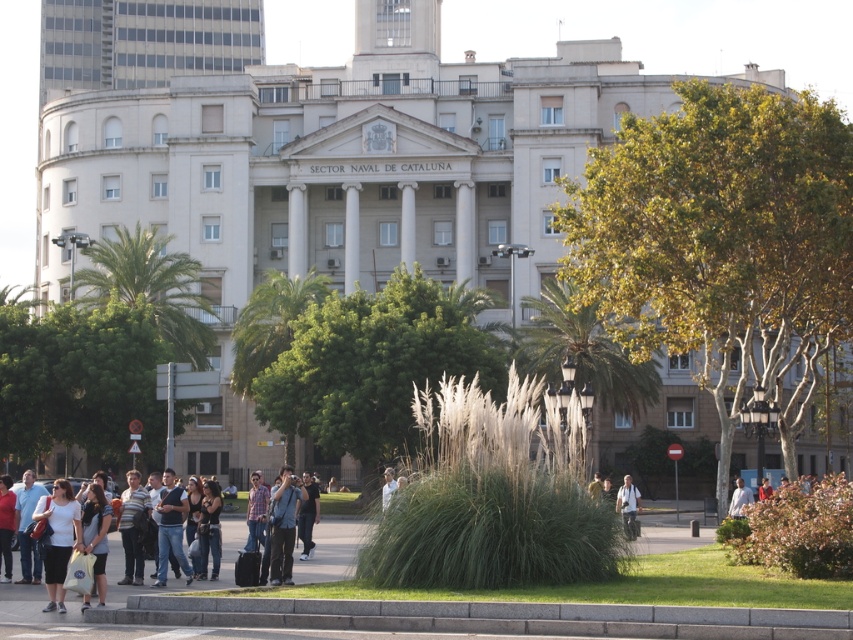
You are standing at the point marked as point (628, 506) in the image. You need to place a light brown backpack at lower right. Is the current location suitable for placing the backpack?

The light brown backpack at lower right is already located at point (628, 506), so the current location is suitable for placing the backpack.

You are a photographer positioned at the center of the green space in front of the SECTOR NAVAL DE CATALUNYA building. You want to capture a photo of the building while ensuring the matte black camera at center is in the frame. Based on the camera position, can you determine if the camera will be visible in the photo?

The matte black camera at center is located at point [283,525], which is within the frame of the photo taken from the center of the green space. Therefore, the camera will be visible in the photo.